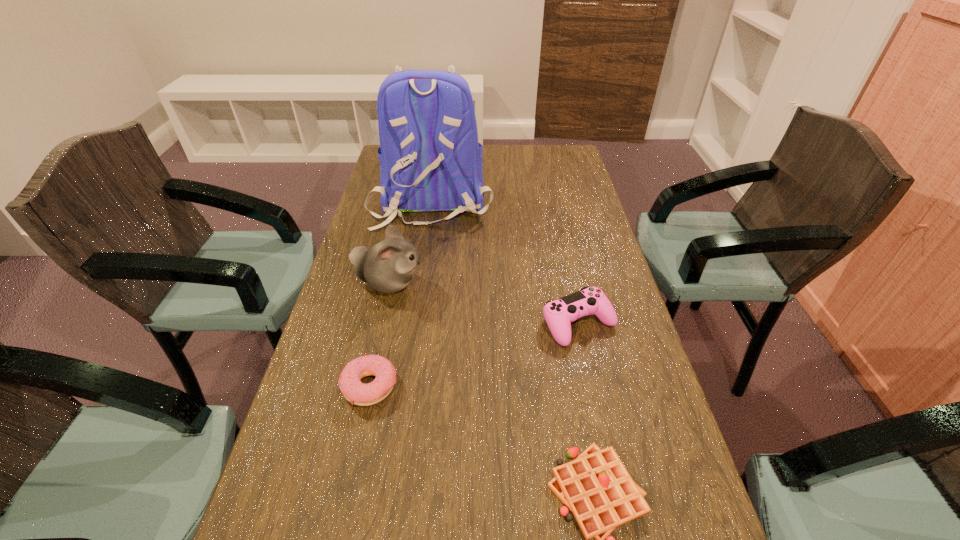
You are a GUI agent. You are given a task and a screenshot of the screen. Output one action in this format:
    pyautogui.click(x=<x>, y=<y>)
    Task: Click on the object present at the far edge
    The image size is (960, 540).
    Given the screenshot: What is the action you would take?
    pyautogui.click(x=430, y=159)

The image size is (960, 540). Identify the location of backpack located in the left edge section of the desktop. (430, 159).

The width and height of the screenshot is (960, 540). I want to click on hamster that is at the left edge, so click(388, 267).

At what (x,y) coordinates should I click in order to perform the action: click on doughnut at the left edge. Please return your answer as a coordinate pair (x, y). Image resolution: width=960 pixels, height=540 pixels. Looking at the image, I should click on point(356,392).

Locate an element on the screen. object located in the right edge section of the desktop is located at coordinates (559, 314).

Find the location of a particular element. object that is at the far left corner is located at coordinates (430, 159).

Find the location of a particular element. This screenshot has height=540, width=960. vacant space at the right edge of the desktop is located at coordinates (633, 356).

Where is `blank region between the backpack and the hamster`? This screenshot has height=540, width=960. blank region between the backpack and the hamster is located at coordinates (411, 242).

The width and height of the screenshot is (960, 540). Identify the location of vacant space in between the second tallest object and the control. [484, 303].

Locate an element on the screen. The width and height of the screenshot is (960, 540). free space between the doughnut and the third tallest object is located at coordinates (474, 355).